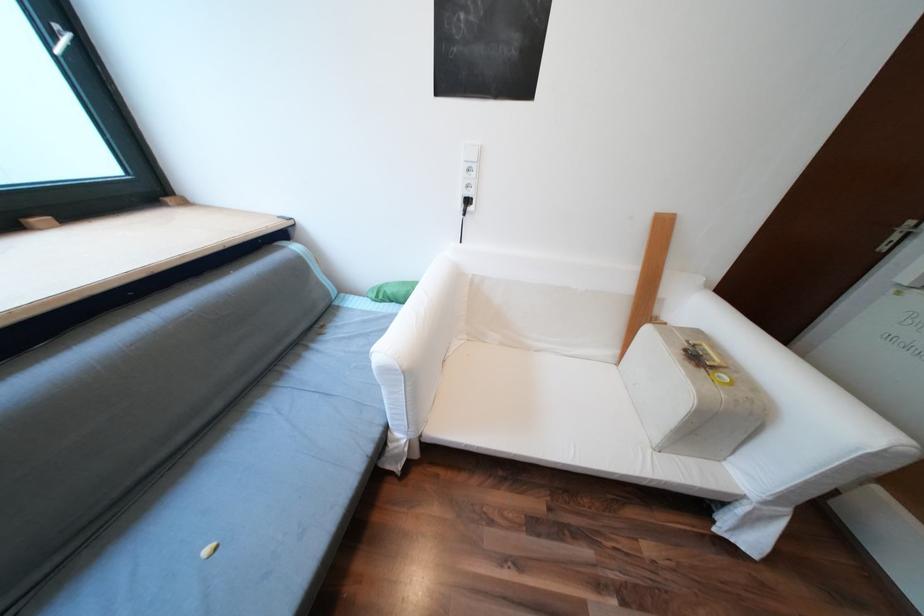
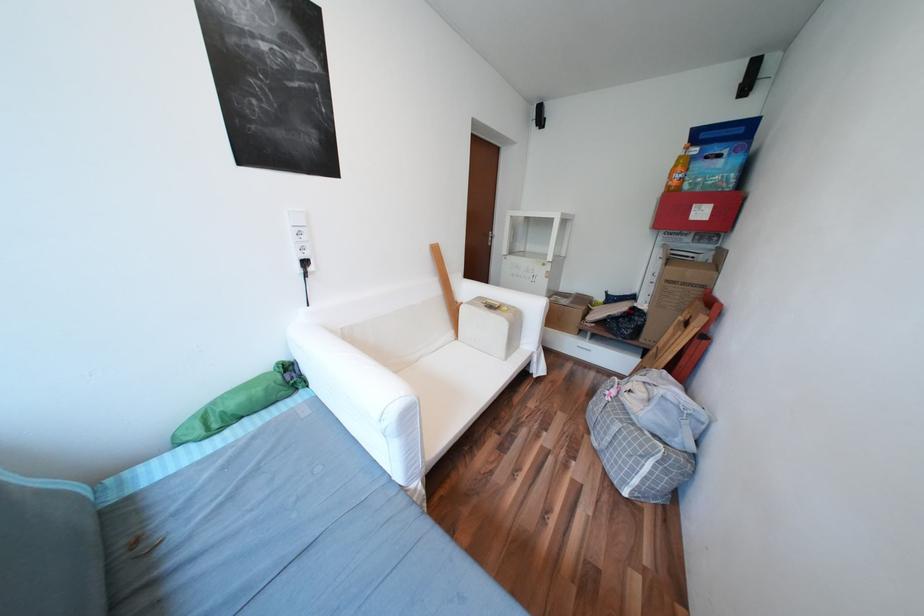
Question: The images are taken continuously from a first-person perspective. In which direction is your viewpoint rotating?

Choices:
 (A) Left
 (B) Right
 (C) Up
 (D) Down

Answer: (B)